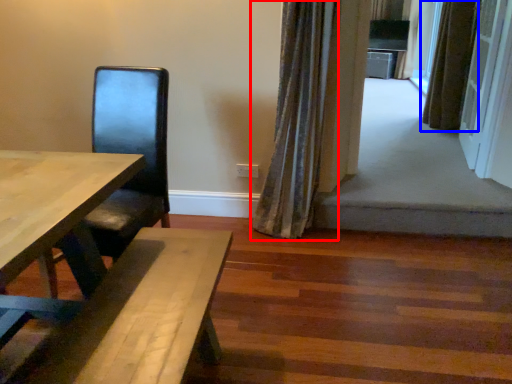
Question: Which of the following is the farthest to the observer, curtain (highlighted by a red box) or curtain (highlighted by a blue box)?

Choices:
 (A) curtain
 (B) curtain

Answer: (B)